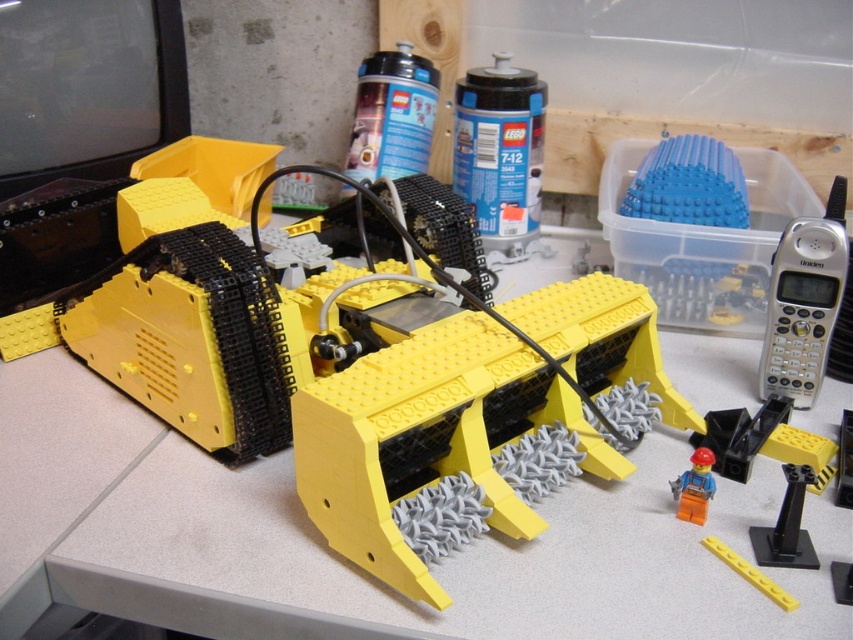
You are a child who wants to reach the yellow plastic toy at center on a table. You are standing 1 meter away from the table. Can you reach it without moving your feet?

The yellow plastic toy at center is 57.70 centimeters away from the camera, so if you are standing 1 meter away from the table, you cannot reach it without moving your feet because the distance is greater than the typical arm length of a child.

You are a LEGO enthusiast trying to place a small sticker on the bulldozer model. You have two options for placement based on coordinates provided. The first point is at coordinates point (537, 225) and the second is at point (759, 364). If you want to place the sticker where it won t be covered by another part of the bulldozer, which coordinate should you choose?

Point (537, 225) is behind point (759, 364), so placing the sticker at point (759, 364) would be less likely to be covered by another part of the bulldozer.

You are a child trying to reach the silver metallic phone at right from the blue plastic canister at upper center. Given that the average child has an arm span of 20 inches, can you comfortably reach it?

The distance between the blue plastic canister at upper center and the silver metallic phone at right is 17.98 inches, which is less than the child average arm span of 20 inches. Therefore, the child can comfortably reach the silver metallic phone at right from the blue plastic canister at upper center.